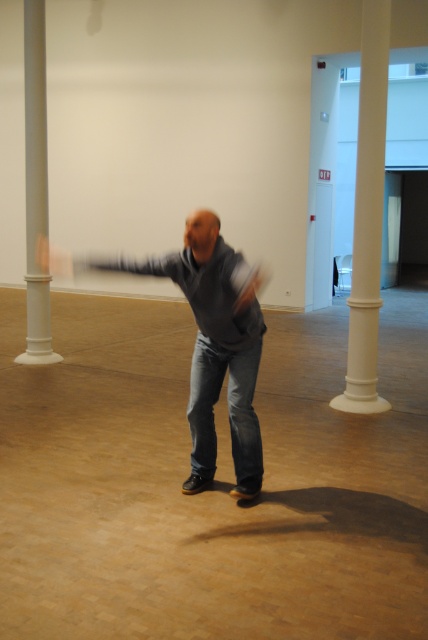
Based on the photo, you are a delivery person carrying a box that is 2 meters wide. You need to walk through the space between the white smooth column at right and the other column. Can you pass through without tilting the box?

The distance between the white smooth column at right and the other column is 5.04 meters. Since the box is only 2 meters wide, there is enough space to pass through without tilting the box.